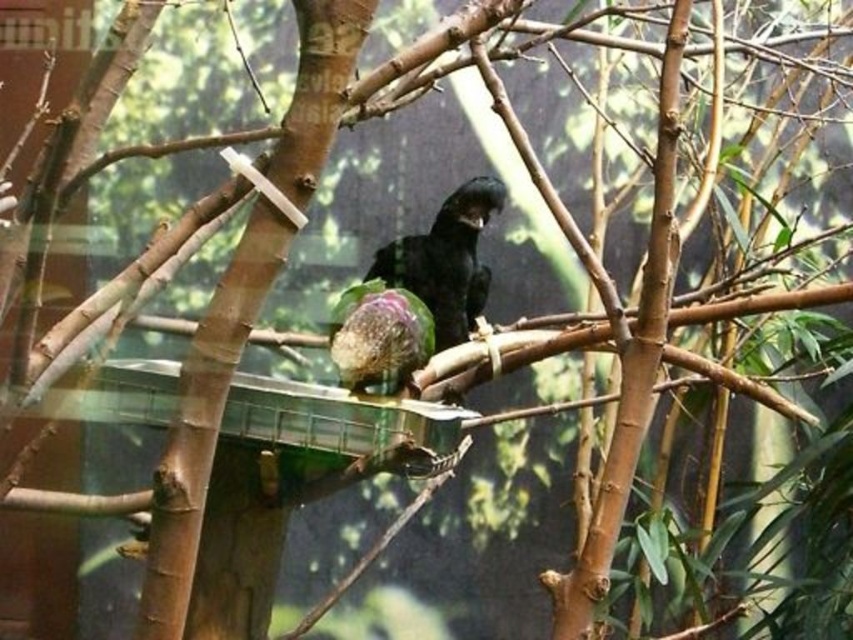
Is point (463, 291) closer to viewer compared to point (386, 312)?

No, it is not.

Can you confirm if shiny black bird at center is bigger than speckled green parrot at center?

Yes, shiny black bird at center is bigger than speckled green parrot at center.

The width and height of the screenshot is (853, 640). Identify the location of shiny black bird at center. (445, 260).

This screenshot has width=853, height=640. I want to click on shiny black bird at center, so click(x=445, y=260).